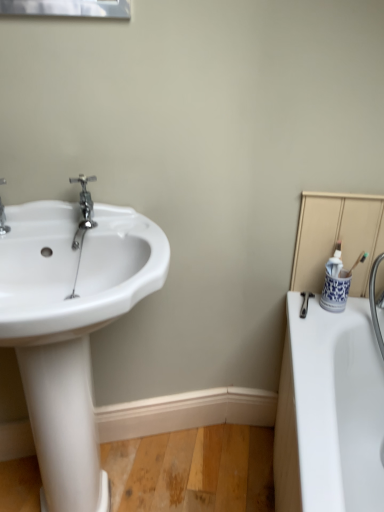
At what (x,y) coordinates should I click in order to perform the action: click on empty space that is to the right of polished chrome faucet at left. Please return your answer as a coordinate pair (x, y). Looking at the image, I should click on (129, 226).